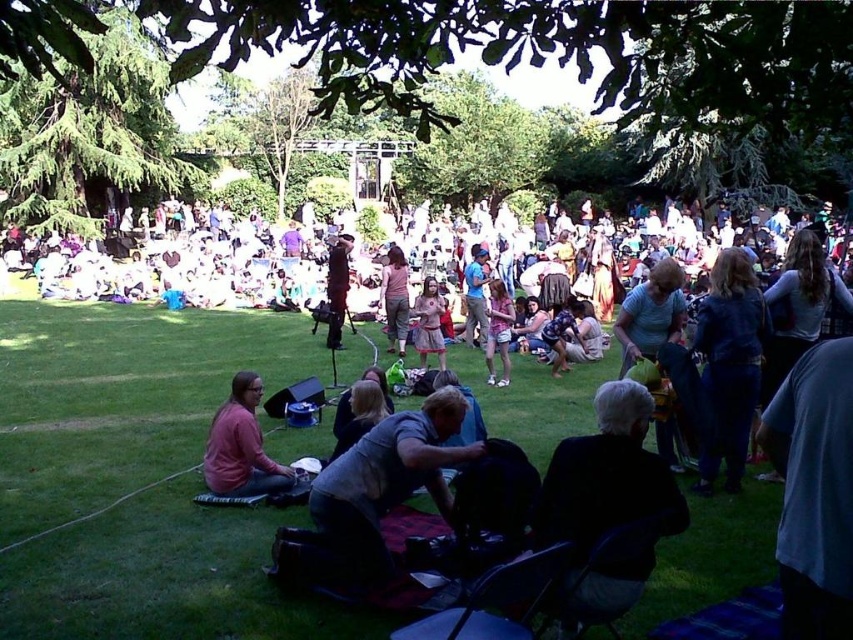
Does dark gray fabric chair at lower right have a greater height compared to pink matte sweater at lower left?

Yes, dark gray fabric chair at lower right is taller than pink matte sweater at lower left.

The image size is (853, 640). What do you see at coordinates (607, 476) in the screenshot?
I see `dark gray fabric chair at lower right` at bounding box center [607, 476].

Is point (537, 506) positioned before point (250, 424)?

Yes, it is in front of point (250, 424).

Where is `dark gray fabric chair at lower right`? The image size is (853, 640). dark gray fabric chair at lower right is located at coordinates (607, 476).

Based on the photo, can you confirm if gray fabric bag at center is thinner than light pink denim shorts at center?

No.

Is gray fabric bag at center shorter than light pink denim shorts at center?

Correct, gray fabric bag at center is not as tall as light pink denim shorts at center.

The height and width of the screenshot is (640, 853). What do you see at coordinates (386, 483) in the screenshot? I see `gray fabric bag at center` at bounding box center [386, 483].

The width and height of the screenshot is (853, 640). I want to click on gray fabric bag at center, so click(x=386, y=483).

Who is more distant from viewer, (717, 372) or (399, 289)?

Point (399, 289)

Who is higher up, denim jacket at right or pink fabric skirt at center?

pink fabric skirt at center is above.

Does point (746, 330) come closer to viewer compared to point (408, 305)?

Yes, point (746, 330) is closer to viewer.

Where is `denim jacket at right`? denim jacket at right is located at coordinates click(728, 365).